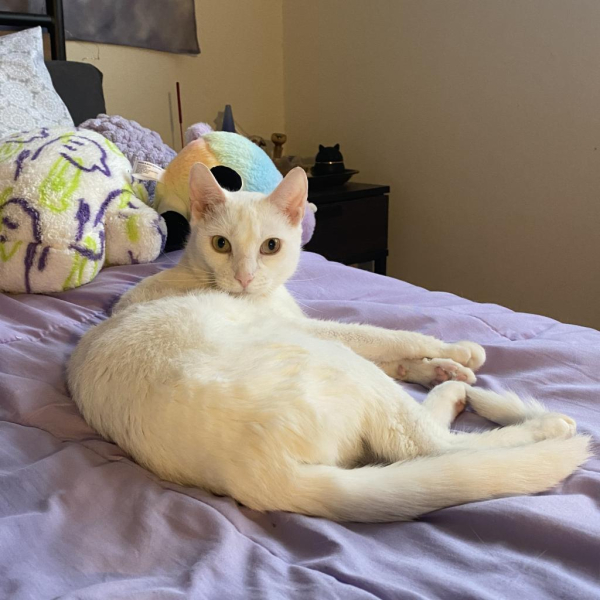
Where is `bed`? bed is located at coordinates (39, 377).